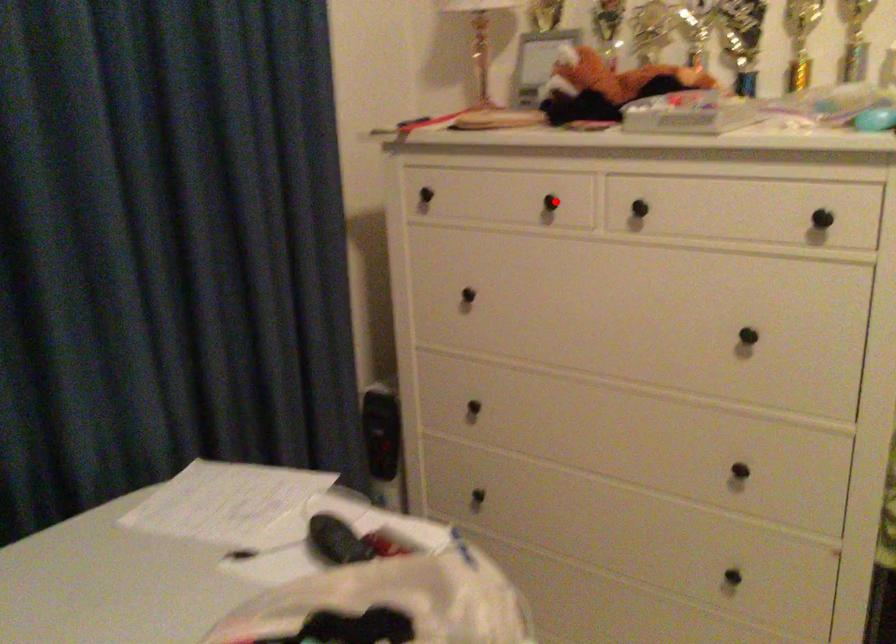
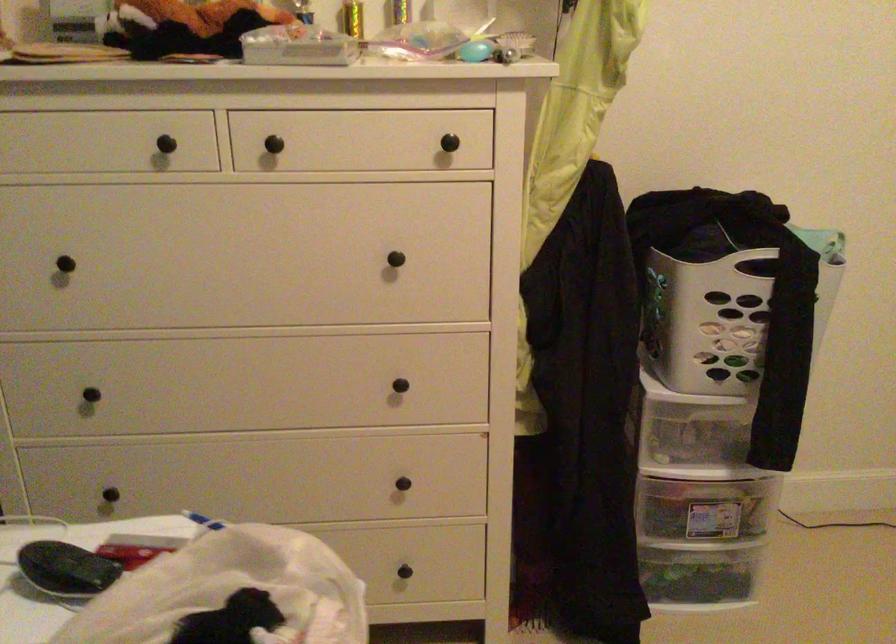
Locate, in the second image, the point that corresponds to the highlighted location in the first image.

(173, 142)